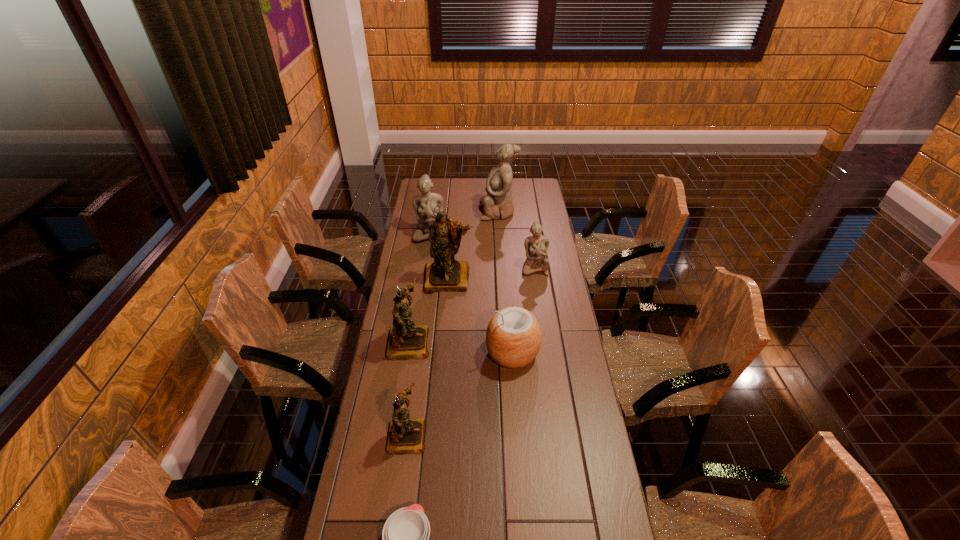
Image resolution: width=960 pixels, height=540 pixels. What are the coordinates of `coconut at the right edge` in the screenshot? It's located at (513, 337).

You are a GUI agent. You are given a task and a screenshot of the screen. Output one action in this format:
    pyautogui.click(x=<x>, y=<y>)
    Task: Click on the figurine at the right edge
    
    Given the screenshot: What is the action you would take?
    pyautogui.click(x=536, y=246)

Identify the location of blank space at the far edge of the desktop. The height and width of the screenshot is (540, 960). (472, 185).

This screenshot has height=540, width=960. Find the location of `vacant space at the left edge of the desktop`. vacant space at the left edge of the desktop is located at coordinates (418, 295).

This screenshot has width=960, height=540. In the image, there is a desktop. Identify the location of blank space at the right edge. (544, 223).

Identify the location of free space at the far left corner of the desktop. pos(439,180).

Identify the location of vacant area at the far right corner. Image resolution: width=960 pixels, height=540 pixels. tap(519, 193).

Locate an element on the screen. free space between the second nearest figurine and the coconut is located at coordinates (461, 347).

Where is `object that stands as the third closest to the nearest gold figurine`? The width and height of the screenshot is (960, 540). object that stands as the third closest to the nearest gold figurine is located at coordinates (513, 337).

Point out which object is positioned as the seventh nearest to the smallest gold figurine. Please provide its 2D coordinates. Your answer should be formatted as a tuple, i.e. [(x, y)], where the tuple contains the x and y coordinates of a point satisfying the conditions above.

[(498, 203)]